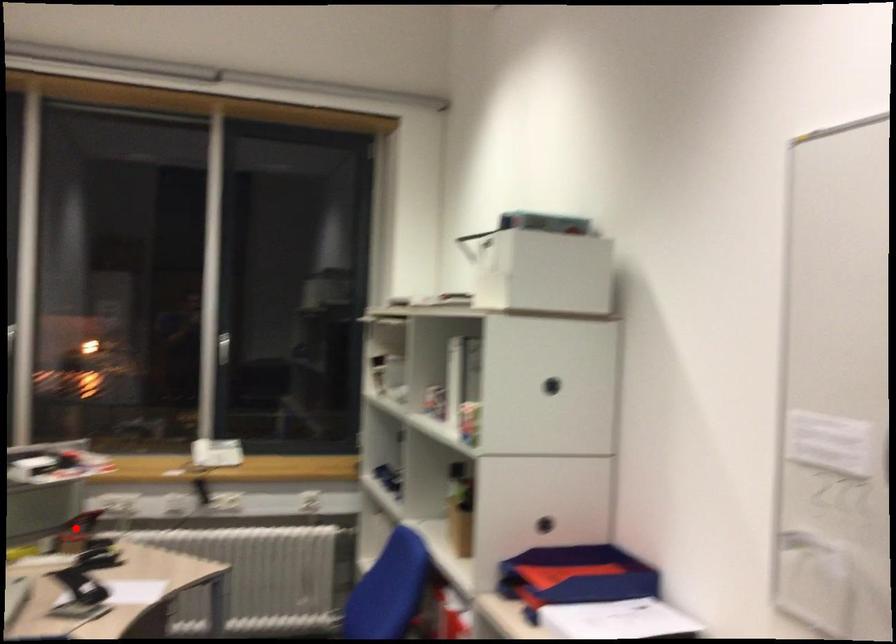
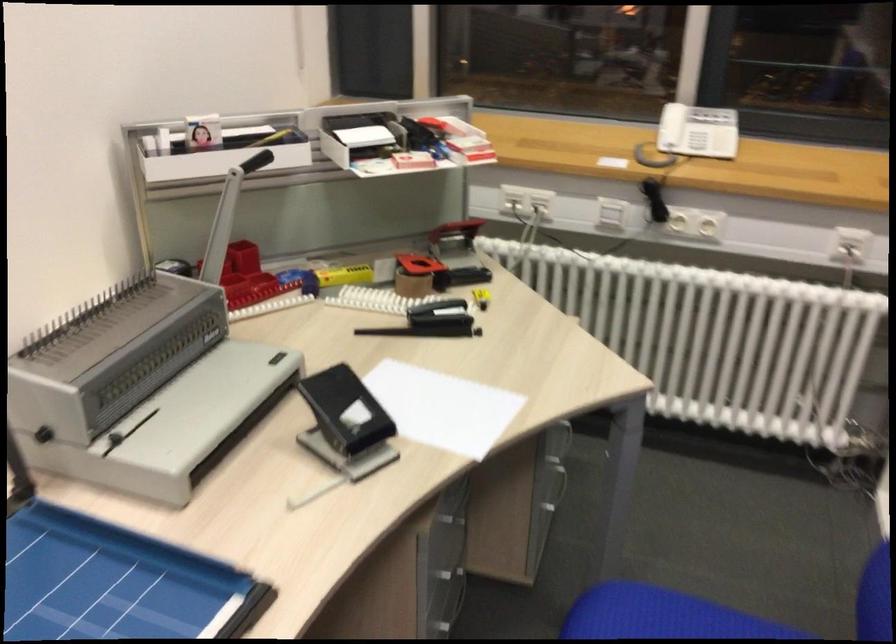
In the second image, find the point that corresponds to the highlighted location in the first image.

(454, 236)